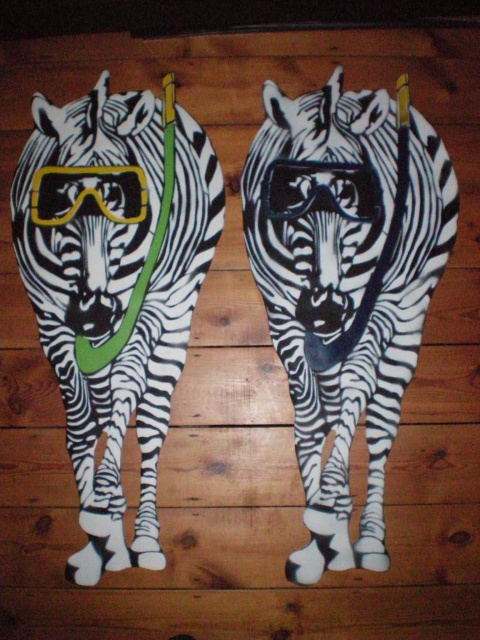
Question: Which object is closer to the camera taking this photo?

Choices:
 (A) matte black zebra at center
 (B) black matte goggles at center

Answer: (A)

Question: Which object is the closest to the matte black zebra at left?

Choices:
 (A) matte black zebra at center
 (B) black matte goggles at center
 (C) yellow matte goggles at center

Answer: (C)

Question: Is matte black zebra at left positioned behind black matte goggles at center?

Choices:
 (A) yes
 (B) no

Answer: (B)

Question: Can you confirm if matte black zebra at center is smaller than black matte goggles at center?

Choices:
 (A) no
 (B) yes

Answer: (A)

Question: Which point appears farthest from the camera in this image?

Choices:
 (A) (273, 205)
 (B) (325, 262)
 (C) (60, 216)
 (D) (113, 269)

Answer: (A)

Question: Is the position of matte black zebra at center less distant than that of black matte goggles at center?

Choices:
 (A) yes
 (B) no

Answer: (A)